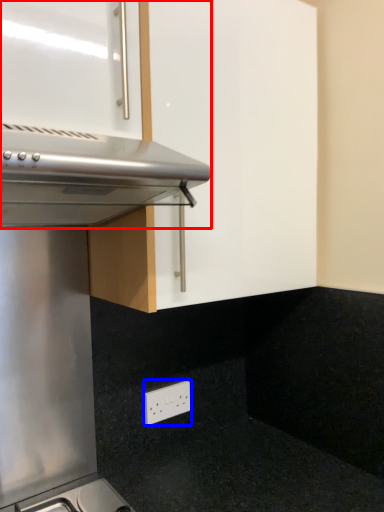
Question: Among these objects, which one is farthest to the camera, oven (highlighted by a red box) or electric outlet (highlighted by a blue box)?

Choices:
 (A) oven
 (B) electric outlet

Answer: (B)